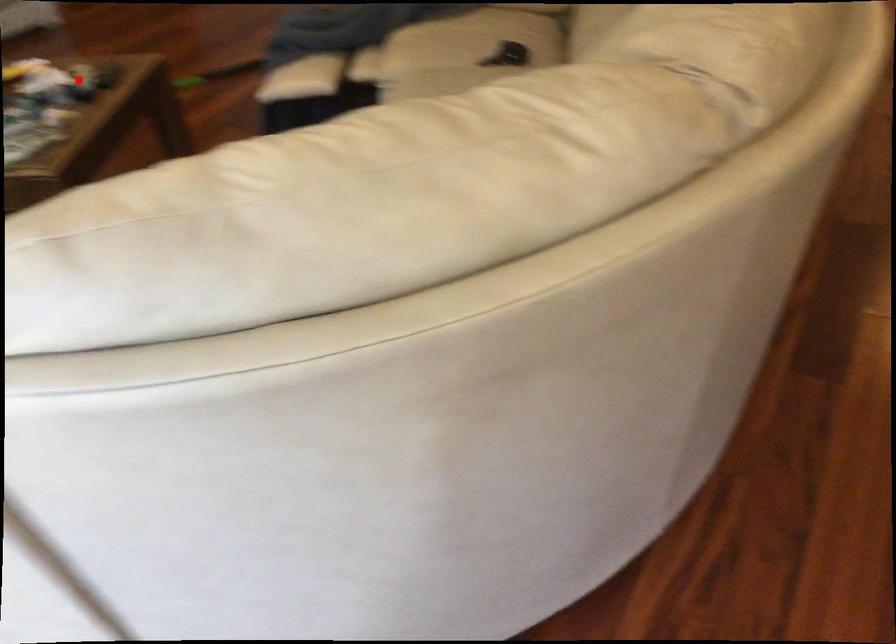
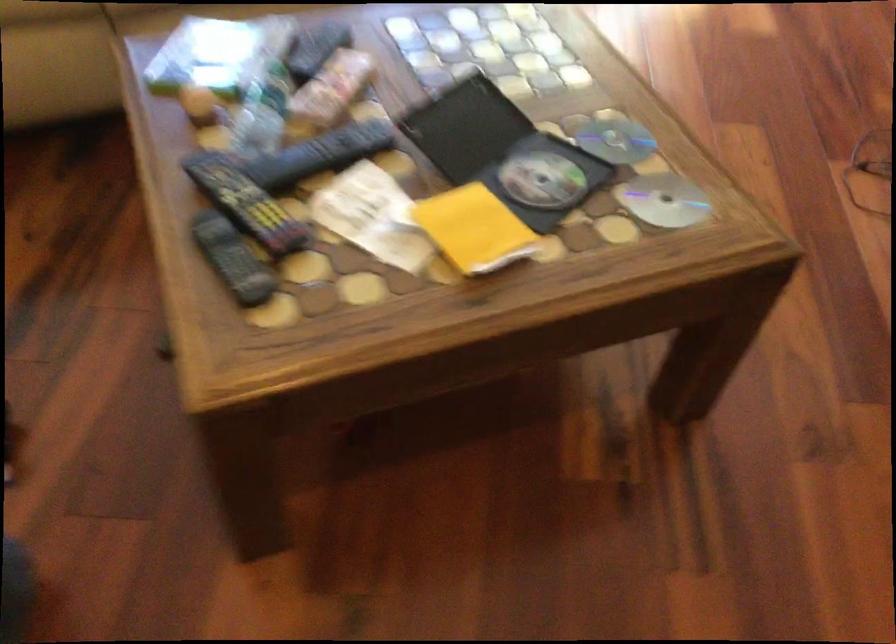
Question: I am providing you with two images of the same scene from different viewpoints. A red point is shown in image1. For the corresponding object point in image2, is it positioned nearer or farther from the camera?

Choices:
 (A) Nearer
 (B) Farther

Answer: (A)